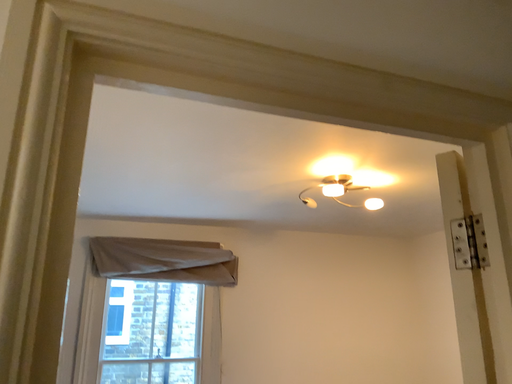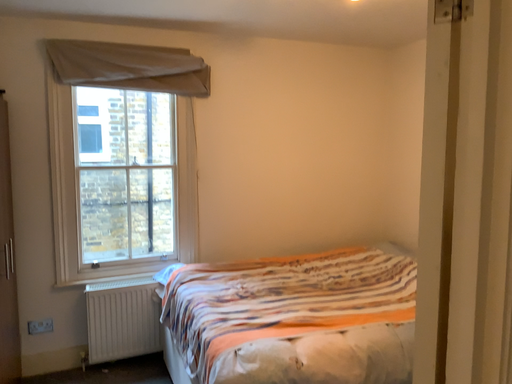
Question: Which way did the camera rotate in the video?

Choices:
 (A) rotated upward
 (B) rotated downward

Answer: (B)